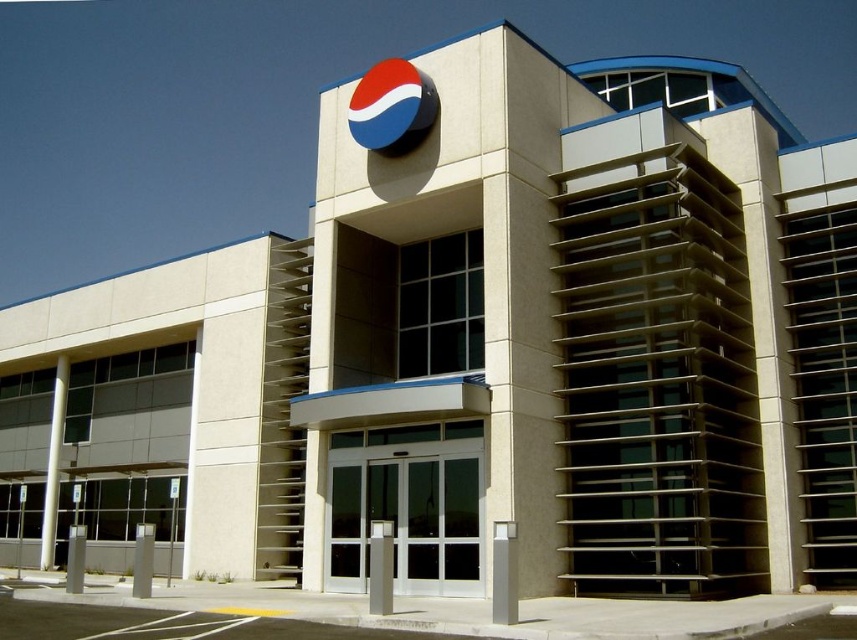
Question: Considering the relative positions of white smooth pillar at left and white concrete pillar at lower left in the image provided, where is white smooth pillar at left located with respect to white concrete pillar at lower left?

Choices:
 (A) below
 (B) above

Answer: (B)

Question: Is satin silver post at center thinner than white concrete pillar at lower left?

Choices:
 (A) yes
 (B) no

Answer: (A)

Question: Is white concrete pillar at lower left bigger than white smooth pillar at lower left?

Choices:
 (A) no
 (B) yes

Answer: (A)

Question: Which point is closer to the camera taking this photo?

Choices:
 (A) (138, 589)
 (B) (508, 548)
 (C) (72, 554)
 (D) (378, 580)

Answer: (B)

Question: Which point appears farthest from the camera in this image?

Choices:
 (A) (372, 548)
 (B) (60, 371)

Answer: (B)

Question: Estimate the real-world distances between objects in this image. Which object is farther from the white concrete pillar at lower left?

Choices:
 (A) white smooth pillar at lower left
 (B) white glossy pillar at center
 (C) white smooth pillar at left
 (D) satin silver post at center

Answer: (C)